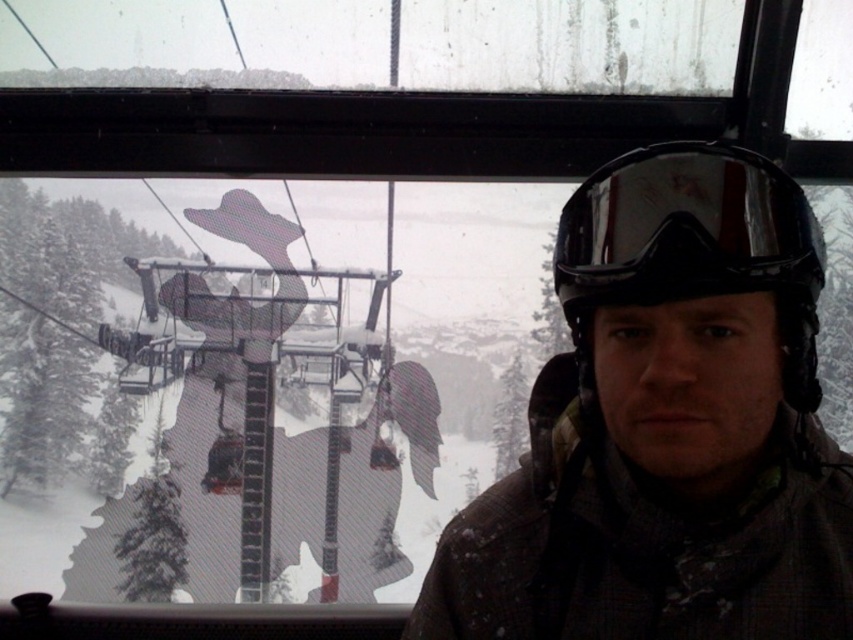
Can you confirm if camouflage jacket at center is positioned below black reflective goggles at center?

Yes.

Which is in front, point (805, 352) or point (706, 157)?

Point (706, 157)

In order to click on camouflage jacket at center in this screenshot , I will do `click(666, 428)`.

Can you confirm if camouflage jacket at center is wider than black matte helmet at center?

Yes.

How far apart are camouflage jacket at center and black matte helmet at center?

A distance of 1.99 inches exists between camouflage jacket at center and black matte helmet at center.

Describe the element at coordinates (666, 428) in the screenshot. Image resolution: width=853 pixels, height=640 pixels. I see `camouflage jacket at center` at that location.

You are a GUI agent. You are given a task and a screenshot of the screen. Output one action in this format:
    pyautogui.click(x=<x>, y=<y>)
    Task: Click on the camouflage jacket at center
    The height and width of the screenshot is (640, 853).
    Given the screenshot: What is the action you would take?
    pyautogui.click(x=666, y=428)

Who is higher up, black matte helmet at center or black reflective goggles at center?

black reflective goggles at center is higher up.

Does black matte helmet at center have a lesser height compared to black reflective goggles at center?

No.

Who is more forward, (x=712, y=220) or (x=608, y=289)?

Point (x=712, y=220) is in front.

Locate an element on the screen. Image resolution: width=853 pixels, height=640 pixels. black matte helmet at center is located at coordinates (694, 253).